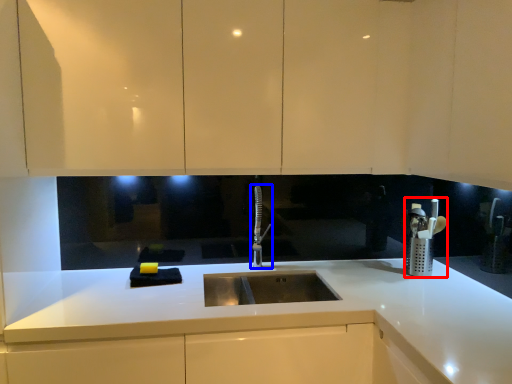
Question: Among these objects, which one is nearest to the camera, appliance (highlighted by a red box) or tap (highlighted by a blue box)?

Choices:
 (A) appliance
 (B) tap

Answer: (B)